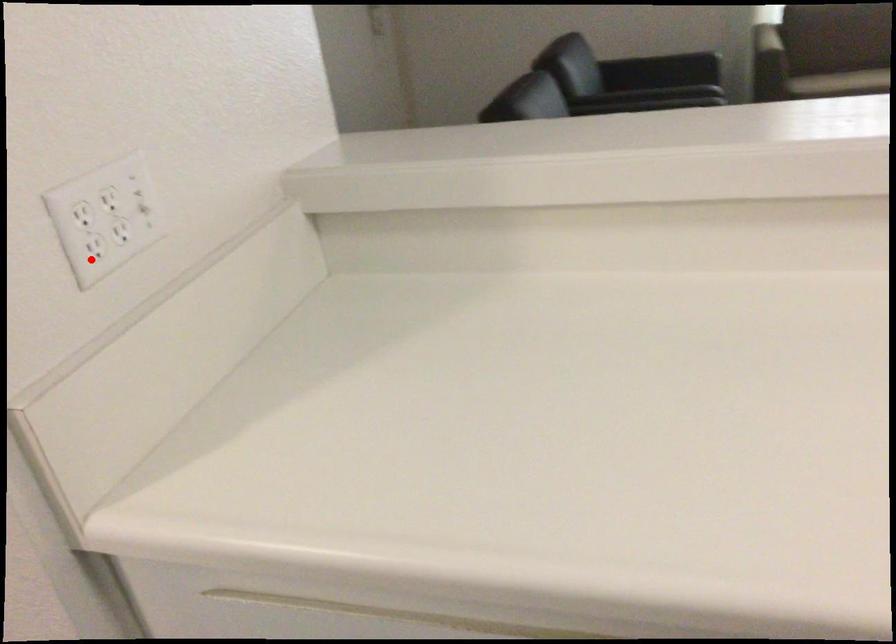
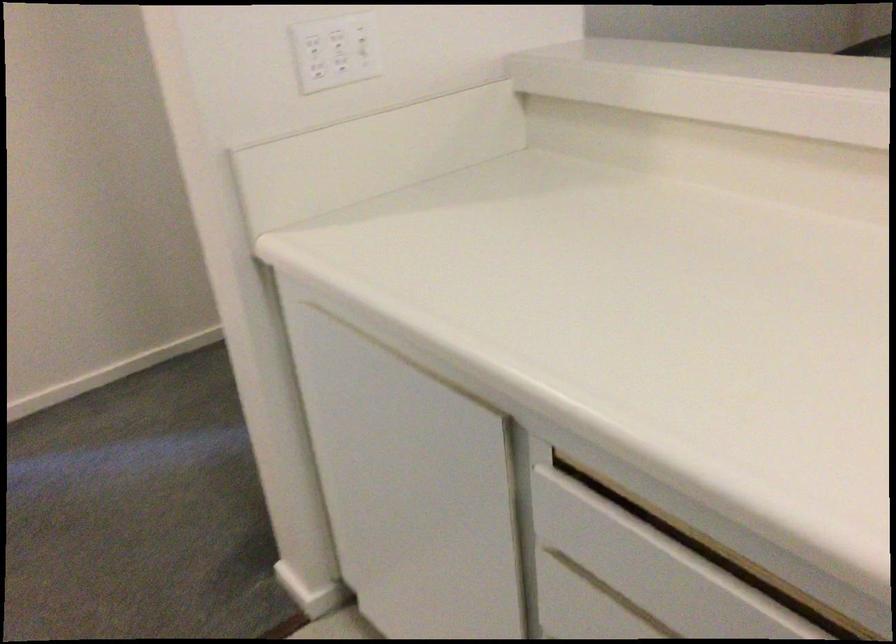
Where in the second image is the point corresponding to the highlighted location from the first image?

(312, 77)